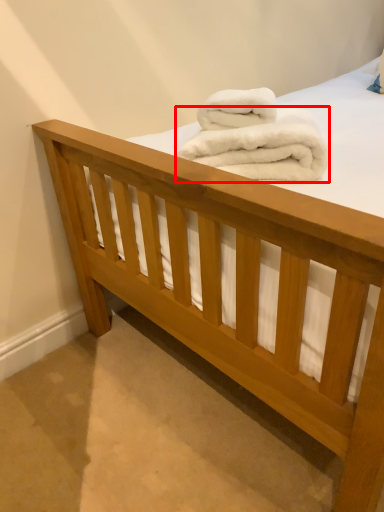
Question: In this image, where is towel (annotated by the red box) located relative to towel?

Choices:
 (A) left
 (B) right

Answer: (B)